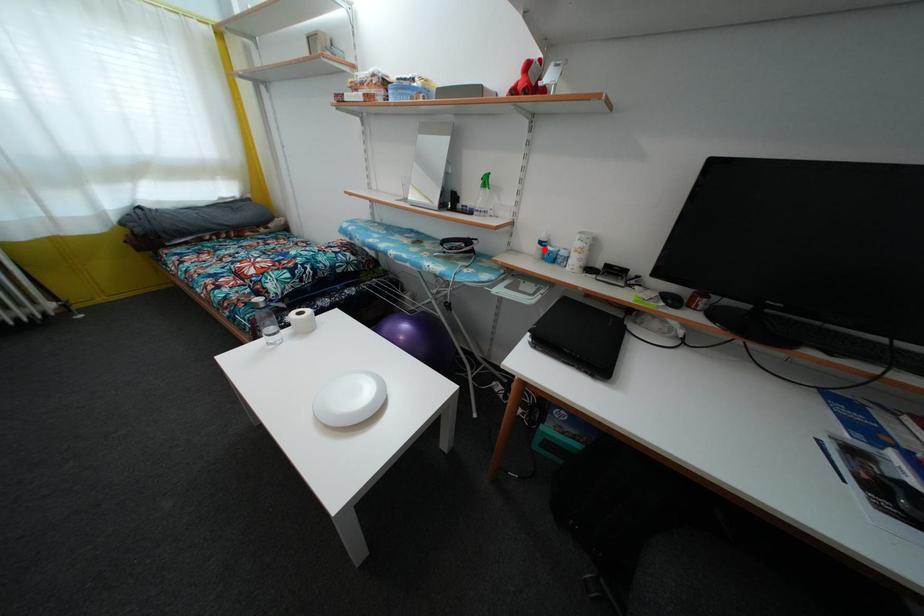
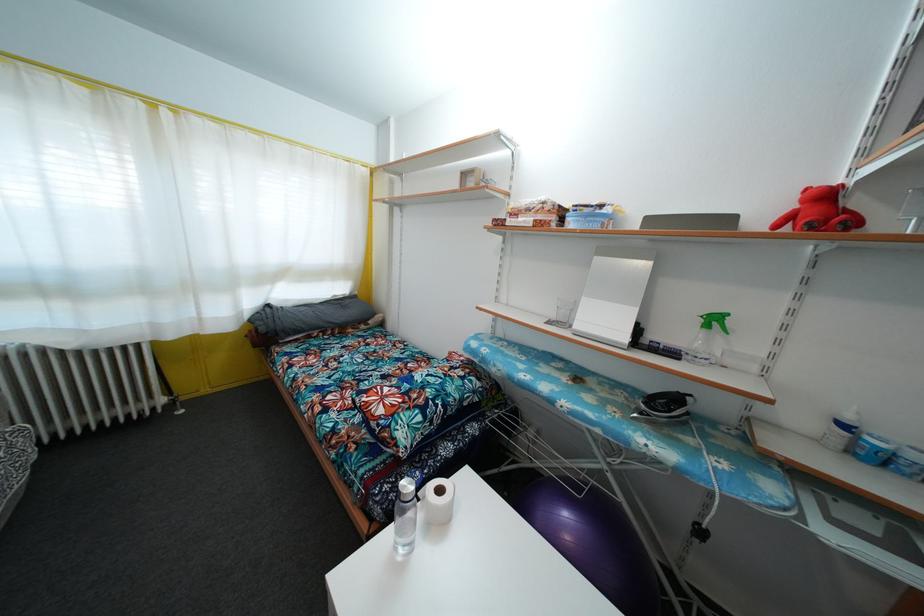
Find the pixel in the second image that matches the highlighted location in the first image.

(848, 432)